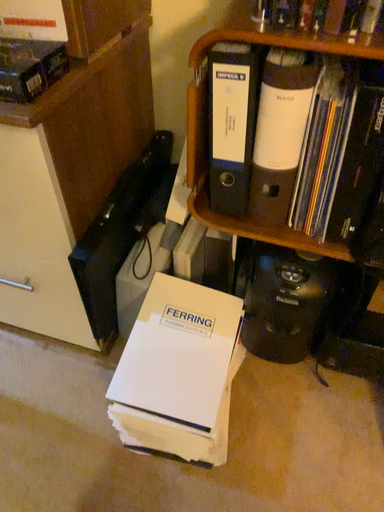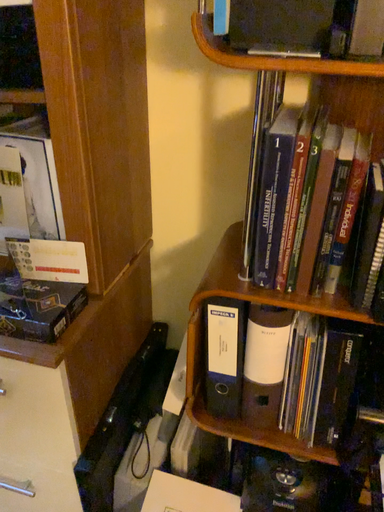
Question: Which way did the camera rotate in the video?

Choices:
 (A) rotated downward
 (B) rotated upward

Answer: (B)